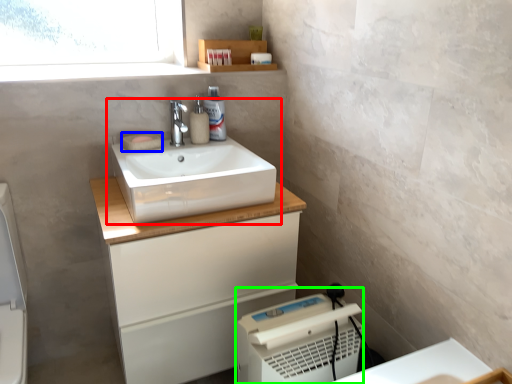
Question: Based on their relative distances, which object is nearer to sink (highlighted by a red box)? Choose from soap (highlighted by a blue box) and appliance (highlighted by a green box).

Choices:
 (A) soap
 (B) appliance

Answer: (A)